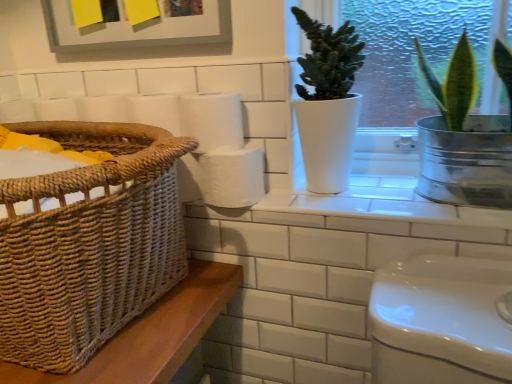
Question: From the image's perspective, is white matte paper towel at center above metallic silver pot at upper right, which is the first houseplant in right-to-left order?

Choices:
 (A) yes
 (B) no

Answer: (A)

Question: Can you confirm if white matte paper towel at center is smaller than metallic silver pot at upper right, which is the first houseplant in right-to-left order?

Choices:
 (A) yes
 (B) no

Answer: (A)

Question: Is white matte paper towel at center positioned far away from metallic silver pot at upper right, which is counted as the second houseplant, starting from the left?

Choices:
 (A) no
 (B) yes

Answer: (A)

Question: Can we say white matte paper towel at center lies outside metallic silver pot at upper right, which is the first houseplant in right-to-left order?

Choices:
 (A) yes
 (B) no

Answer: (A)

Question: Considering the relative sizes of white matte paper towel at center and metallic silver pot at upper right, which is counted as the second houseplant, starting from the left, in the image provided, is white matte paper towel at center wider than metallic silver pot at upper right, which is counted as the second houseplant, starting from the left,?

Choices:
 (A) no
 (B) yes

Answer: (A)

Question: Considering the relative sizes of white matte paper towel at center and metallic silver pot at upper right, which is the first houseplant in right-to-left order, in the image provided, is white matte paper towel at center shorter than metallic silver pot at upper right, which is the first houseplant in right-to-left order,?

Choices:
 (A) no
 (B) yes

Answer: (B)

Question: From the image's perspective, is white matte toilet paper at center on top of white ceramic window sill at upper center?

Choices:
 (A) no
 (B) yes

Answer: (B)

Question: Is white matte toilet paper at center in contact with white ceramic window sill at upper center?

Choices:
 (A) yes
 (B) no

Answer: (B)

Question: Is white matte toilet paper at center positioned before white ceramic window sill at upper center?

Choices:
 (A) no
 (B) yes

Answer: (A)

Question: From a real-world perspective, is white matte toilet paper at center below white ceramic window sill at upper center?

Choices:
 (A) yes
 (B) no

Answer: (B)

Question: Is white ceramic window sill at upper center located within white matte toilet paper at center?

Choices:
 (A) no
 (B) yes

Answer: (A)

Question: Is white matte toilet paper at center shorter than white ceramic window sill at upper center?

Choices:
 (A) yes
 (B) no

Answer: (B)

Question: Is white matte toilet paper at center not inside woven brown basket at left?

Choices:
 (A) no
 (B) yes

Answer: (B)